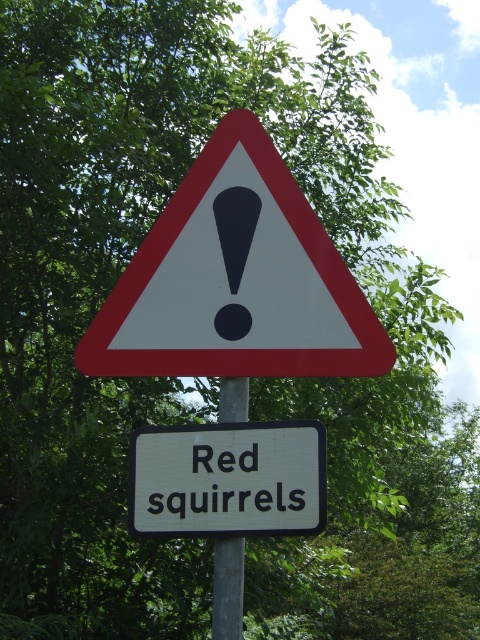
Question: Where is white paper triangle at center located in relation to white painted rectangular at center in the image?

Choices:
 (A) above
 (B) below

Answer: (A)

Question: Which of the following is the closest to the observer?

Choices:
 (A) white painted rectangular at center
 (B) white paper triangle at center

Answer: (A)

Question: Is white paper triangle at center bigger than gray metallic pole at center?

Choices:
 (A) yes
 (B) no

Answer: (A)

Question: Can you confirm if white paper triangle at center is smaller than gray metallic pole at center?

Choices:
 (A) yes
 (B) no

Answer: (B)

Question: Which object appears closest to the camera in this image?

Choices:
 (A) gray metallic pole at center
 (B) white painted rectangular at center

Answer: (B)

Question: Based on their relative distances, which object is nearer to the white paper triangle at center?

Choices:
 (A) gray metallic pole at center
 (B) white painted rectangular at center

Answer: (B)